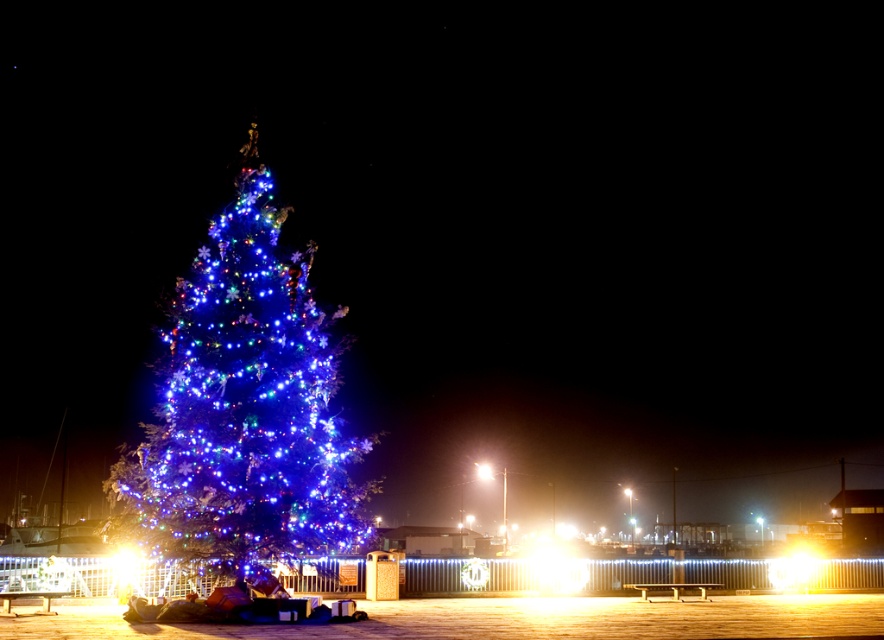
Consider the image. Is the position of illuminated blue lights at center more distant than that of bright white light at center?

No, it is in front of bright white light at center.

Between point (293, 332) and point (490, 472), which one is positioned behind?

Positioned behind is point (490, 472).

This screenshot has height=640, width=884. I want to click on illuminated blue lights at center, so click(244, 404).

Locate an element on the screen. The image size is (884, 640). illuminated blue lights at center is located at coordinates (244, 404).